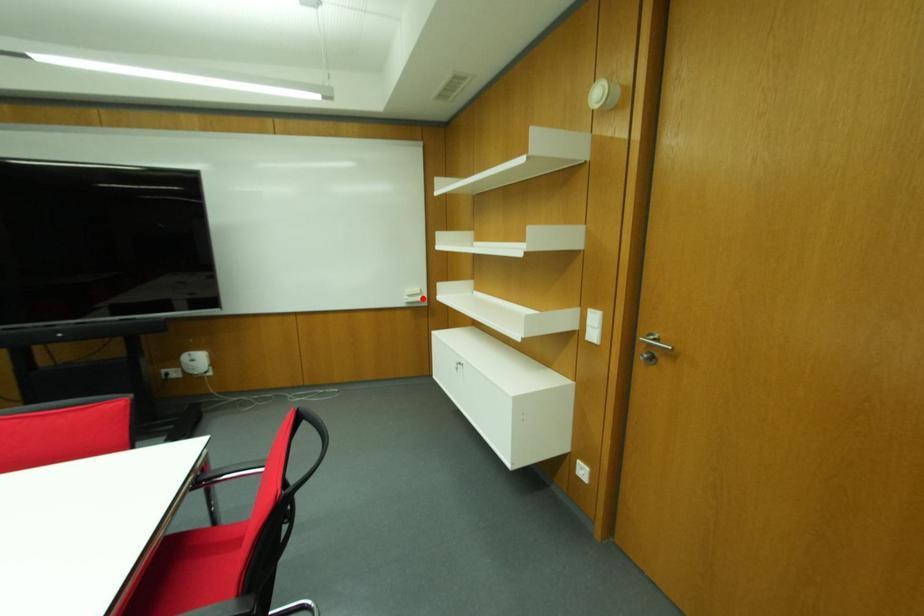
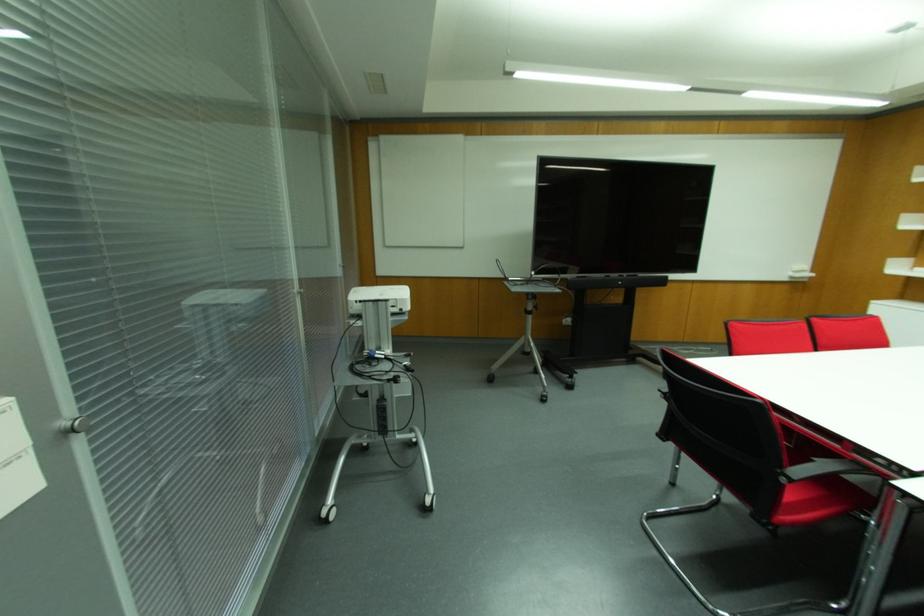
Find the pixel in the second image that matches the highlighted location in the first image.

(811, 274)